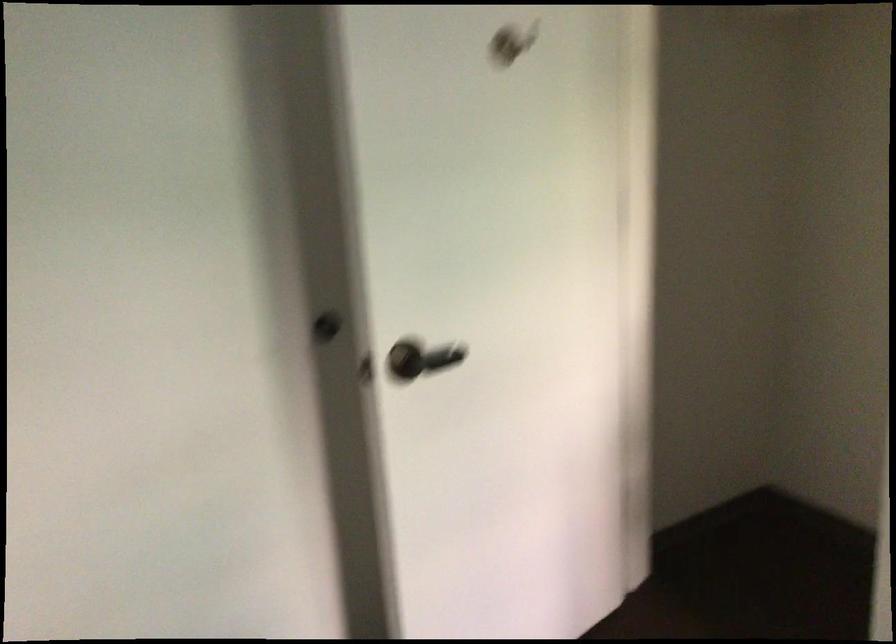
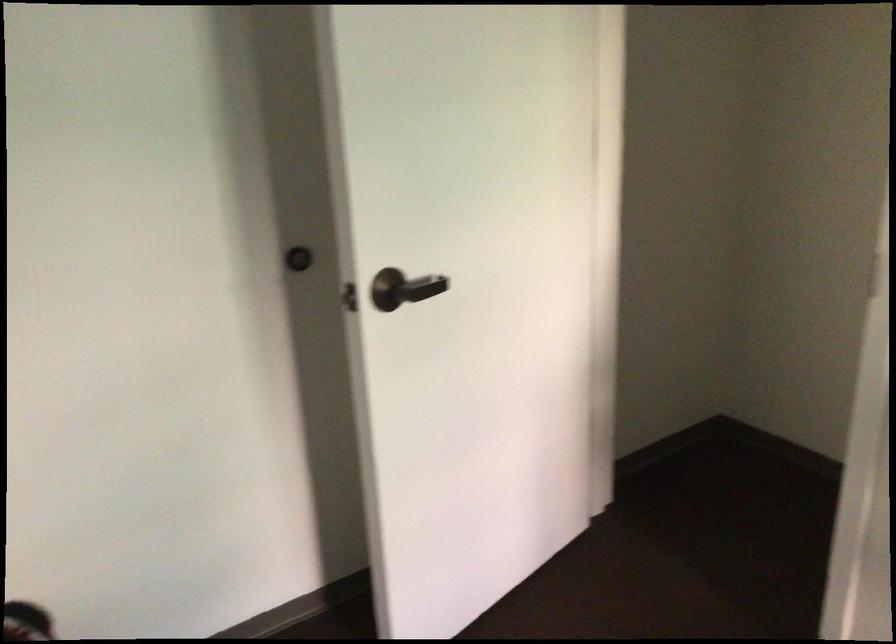
Question: The camera is either moving clockwise (left) or counter-clockwise (right) around the object. The first image is from the beginning of the video and the second image is from the end. Is the camera moving left or right when shooting the video?

Choices:
 (A) Left
 (B) Right

Answer: (A)